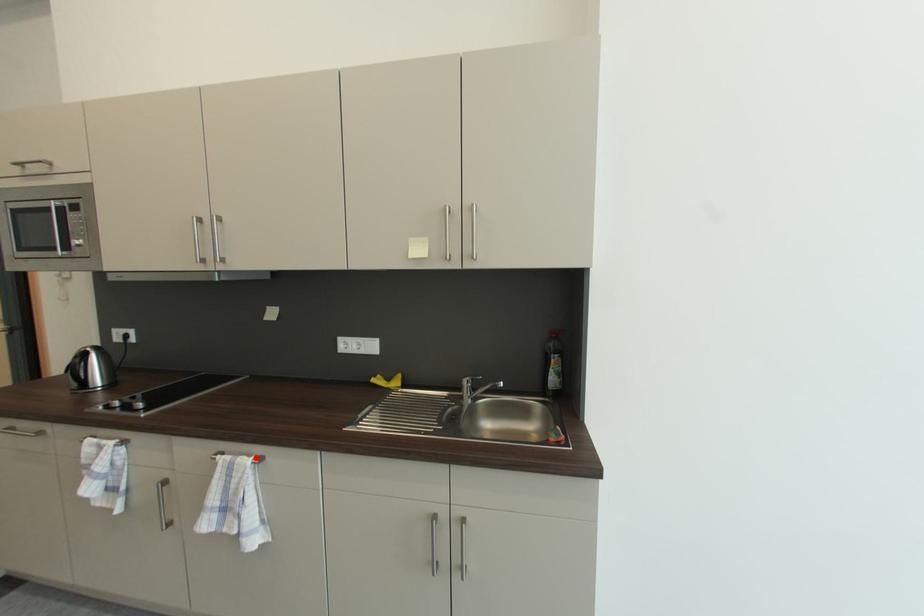
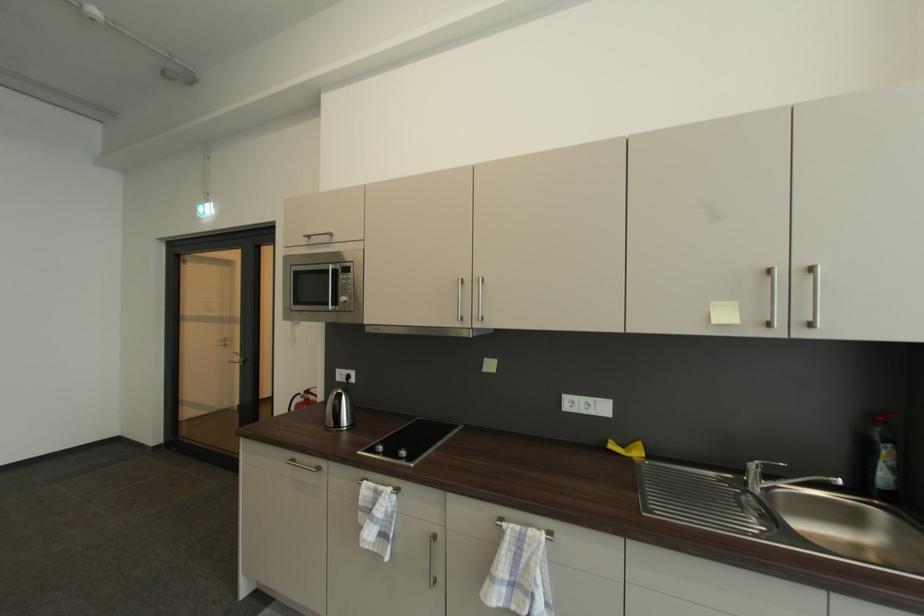
The point at the highlighted location is marked in the first image. Where is the corresponding point in the second image?

(545, 531)